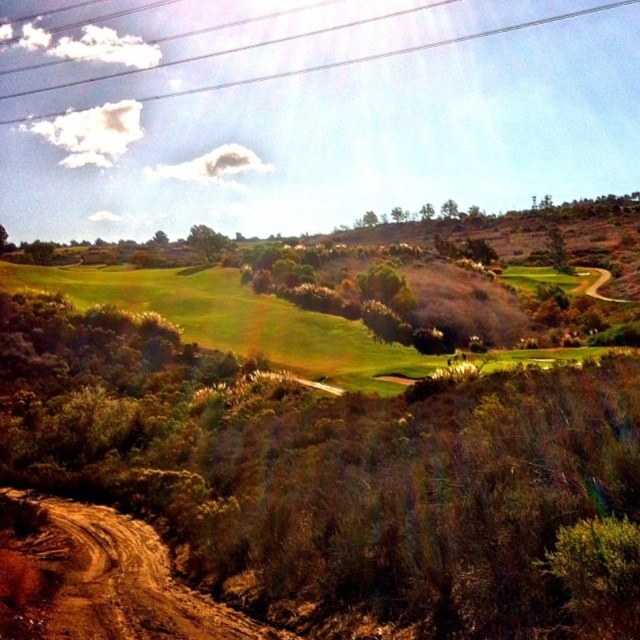
Question: Which of the following is the closest to the observer?

Choices:
 (A) (100, 602)
 (B) (552, 19)

Answer: (A)

Question: Can you confirm if brown dirt track at lower left is thinner than metallic wires at upper center?

Choices:
 (A) no
 (B) yes

Answer: (B)

Question: Among these points, which one is farthest from the camera?

Choices:
 (A) (236, 84)
 (B) (22, 509)

Answer: (A)

Question: Does brown dirt track at lower left have a smaller size compared to metallic wires at upper center?

Choices:
 (A) no
 (B) yes

Answer: (B)

Question: From the image, what is the correct spatial relationship of brown dirt track at lower left in relation to metallic wires at upper center?

Choices:
 (A) left
 (B) right

Answer: (A)